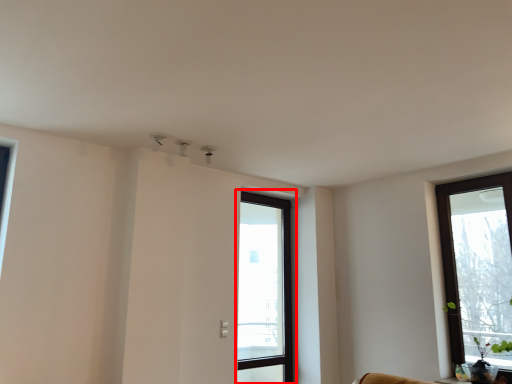
Question: From the image's perspective, where is window (annotated by the red box) located in relation to window in the image?

Choices:
 (A) above
 (B) below

Answer: (B)